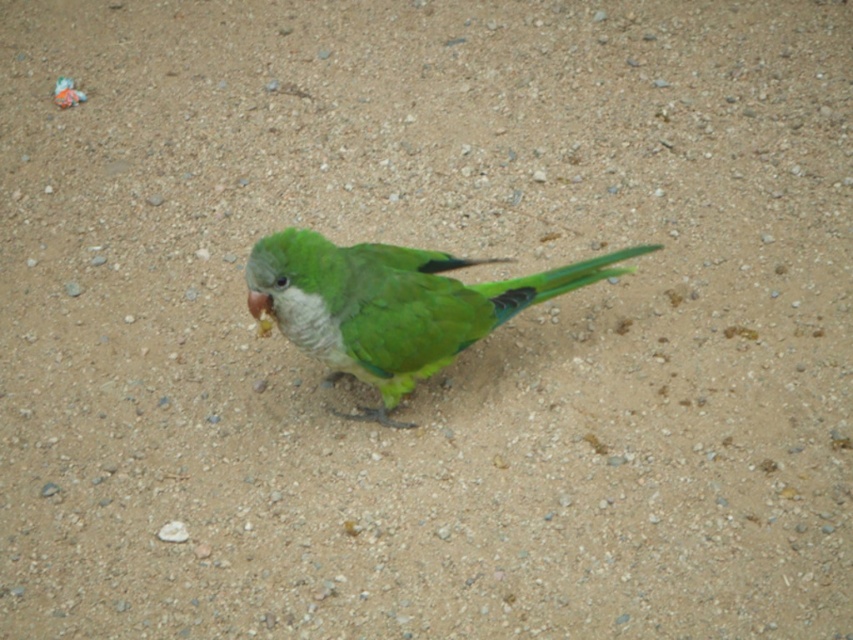
Question: Which point is farther from the camera taking this photo?

Choices:
 (A) (430, 330)
 (B) (256, 310)

Answer: (A)

Question: Which of the following is the closest to the observer?

Choices:
 (A) green matte parrot at center
 (B) matte yellow beak at center

Answer: (A)

Question: Does green matte parrot at center have a larger size compared to matte yellow beak at center?

Choices:
 (A) no
 (B) yes

Answer: (B)

Question: Is green matte parrot at center wider than matte yellow beak at center?

Choices:
 (A) yes
 (B) no

Answer: (A)

Question: Among these objects, which one is nearest to the camera?

Choices:
 (A) green matte parrot at center
 (B) matte yellow beak at center

Answer: (A)

Question: Is green matte parrot at center wider than matte yellow beak at center?

Choices:
 (A) no
 (B) yes

Answer: (B)